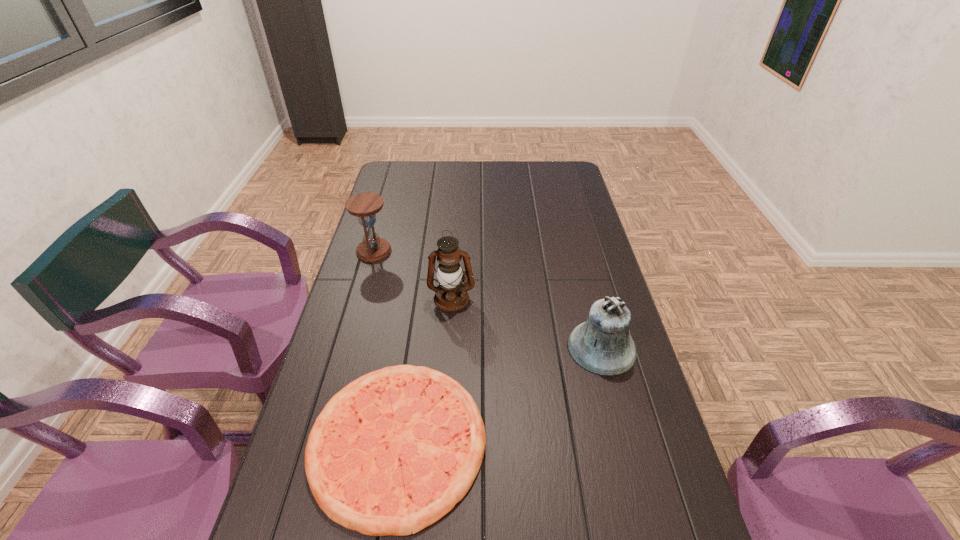
The height and width of the screenshot is (540, 960). In order to click on unoccupied position between the second farthest object and the hourglass in this screenshot , I will do `click(413, 275)`.

At what (x,y) coordinates should I click in order to perform the action: click on free space between the second farthest object and the hourglass. Please return your answer as a coordinate pair (x, y). This screenshot has width=960, height=540. Looking at the image, I should click on (413, 275).

The image size is (960, 540). I want to click on free point between the rightmost object and the lantern, so click(526, 323).

In order to click on free spot between the second farthest object and the farthest object in this screenshot , I will do `click(413, 275)`.

The image size is (960, 540). In order to click on empty space that is in between the bell and the farthest object in this screenshot , I will do `click(488, 300)`.

Identify the location of vacant region between the farthest object and the third nearest object. The width and height of the screenshot is (960, 540). (413, 275).

You are a GUI agent. You are given a task and a screenshot of the screen. Output one action in this format:
    pyautogui.click(x=<x>, y=<y>)
    Task: Click on the object that is the third nearest to the lantern
    This screenshot has width=960, height=540.
    Given the screenshot: What is the action you would take?
    pyautogui.click(x=602, y=345)

Where is `object that ranks as the closest to the shortest object`? The image size is (960, 540). object that ranks as the closest to the shortest object is located at coordinates (449, 273).

At what (x,y) coordinates should I click in order to perform the action: click on free location that satisfies the following two spatial constraints: 1. on the front side of the bell; 2. on the left side of the hourglass. Please return your answer as a coordinate pair (x, y). Looking at the image, I should click on (347, 348).

This screenshot has height=540, width=960. In order to click on free space that satisfies the following two spatial constraints: 1. on the side of the rightmost object, there is a wick adjustment knob; 2. on the left side of the lantern in this screenshot , I will do `click(448, 348)`.